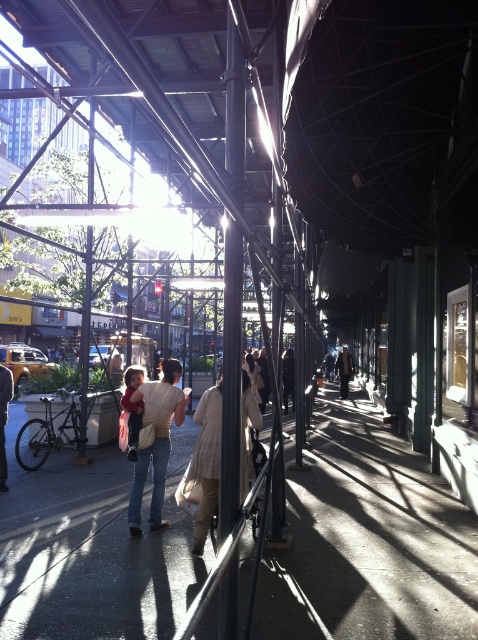
In the scene shown: Can you confirm if concrete sidewalk at center is bigger than denim jacket at center?

Correct, concrete sidewalk at center is larger in size than denim jacket at center.

Can you confirm if concrete sidewalk at center is positioned to the right of denim jacket at center?

Indeed, concrete sidewalk at center is positioned on the right side of denim jacket at center.

Locate an element on the screen. Image resolution: width=478 pixels, height=640 pixels. concrete sidewalk at center is located at coordinates (369, 541).

Between concrete sidewalk at center and beige textured coat at center, which one is positioned higher?

Positioned higher is beige textured coat at center.

You are a GUI agent. You are given a task and a screenshot of the screen. Output one action in this format:
    pyautogui.click(x=<x>, y=<y>)
    Task: Click on the concrete sidewalk at center
    Image resolution: width=478 pixels, height=640 pixels.
    Given the screenshot: What is the action you would take?
    pyautogui.click(x=369, y=541)

This screenshot has width=478, height=640. Identify the location of concrete sidewalk at center. (369, 541).

Does beige textured coat at center lie in front of denim jacket at center?

Yes, it is in front of denim jacket at center.

Who is shorter, beige textured coat at center or denim jacket at center?

beige textured coat at center

Locate an element on the screen. The height and width of the screenshot is (640, 478). beige textured coat at center is located at coordinates (206, 461).